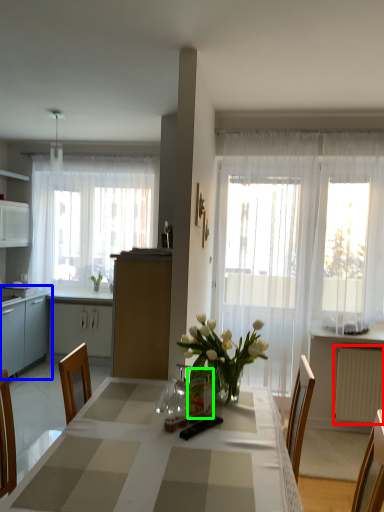
Question: Estimate the real-world distances between objects in this image. Which object is closer to radiator (highlighted by a red box), cabinetry (highlighted by a blue box) or vase (highlighted by a green box)?

Choices:
 (A) cabinetry
 (B) vase

Answer: (B)